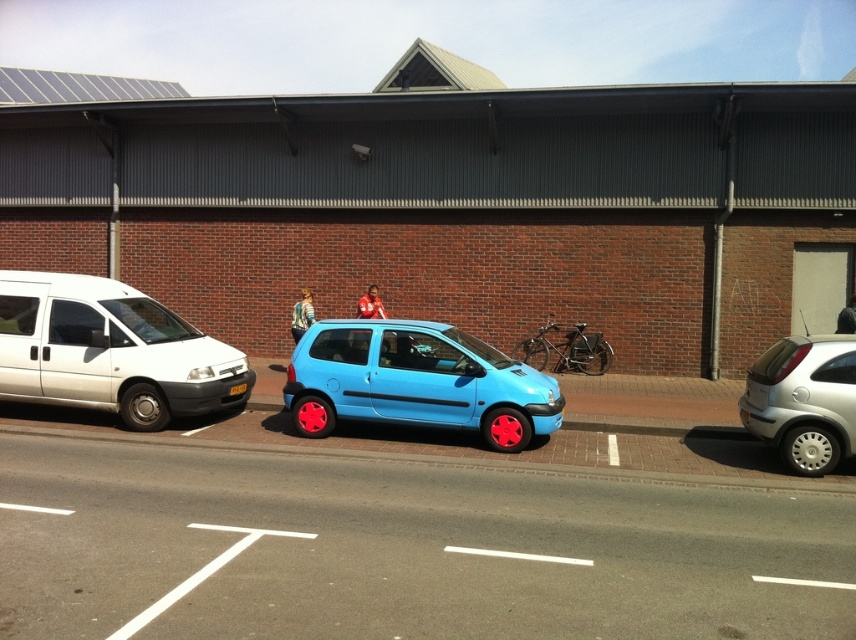
You are a delivery person who needs to place a package on the ground between the matte blue hatchback at center and the black plastic license plate at center. The package requires a space of 2.5 meters to fit. Can you place it there?

The distance between the matte blue hatchback at center and the black plastic license plate at center is 2.65 meters, which is sufficient to accommodate the 2.5 meters required for the package. Yes, you can place the package there.

You are a delivery person trying to attach a package to the matte blue hatchback at center. The package is too big to fit on the roof. Where should you place it instead, considering the black plastic license plate at center?

The matte blue hatchback at center is larger than the black plastic license plate at center, so you should place the package in the trunk of the matte blue hatchback at center instead of on top of the license plate.